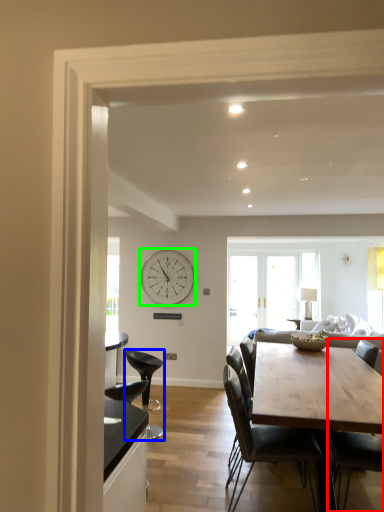
Question: Which object is positioned closest to chair (highlighted by a red box)? Select from chair (highlighted by a blue box) and clock (highlighted by a green box).

Choices:
 (A) chair
 (B) clock

Answer: (A)